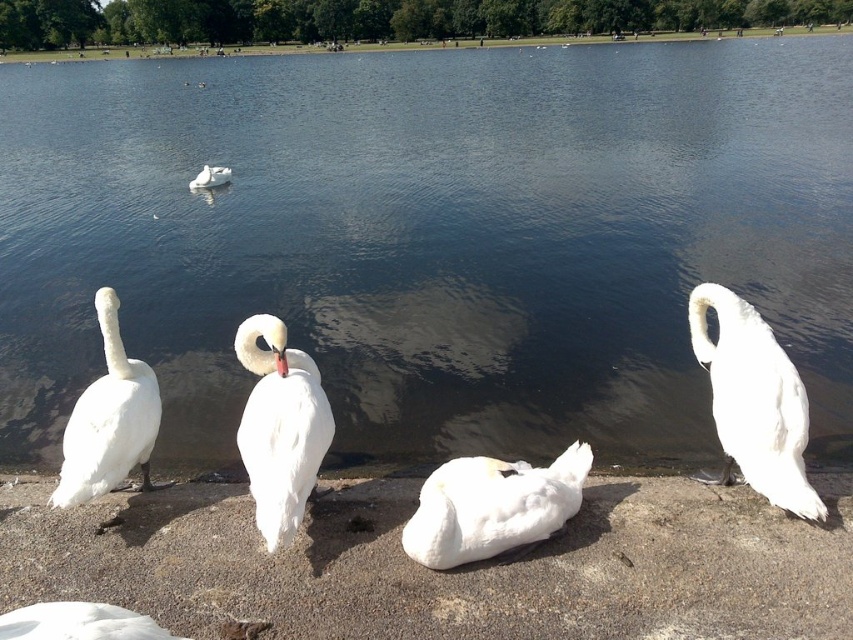
Question: Among these points, which one is nearest to the camera?

Choices:
 (A) (12, 627)
 (B) (222, 168)

Answer: (A)

Question: Is white feathered swan at center closer to camera compared to white feathered swan at upper center?

Choices:
 (A) no
 (B) yes

Answer: (B)

Question: Estimate the real-world distances between objects in this image. Which object is closer to the white feathered swan at center?

Choices:
 (A) white feathered swan at lower left
 (B) white feathered swan at left
 (C) transparent water at center
 (D) white fluffy swan at center

Answer: (B)

Question: Which object is farther from the camera taking this photo?

Choices:
 (A) white feathered swan at lower left
 (B) white fluffy swan at center
 (C) white feathered swan at upper center
 (D) transparent water at center

Answer: (C)

Question: Where is white feathered swan at right located in relation to white fluffy swan at center in the image?

Choices:
 (A) right
 (B) left

Answer: (A)

Question: Observing the image, what is the correct spatial positioning of transparent water at center in reference to white feathered swan at right?

Choices:
 (A) left
 (B) right

Answer: (A)